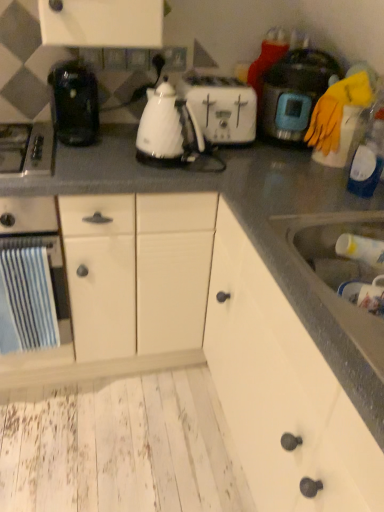
Question: Can you confirm if white glossy electric kettle at center, positioned as the second kitchen appliance in right-to-left order, is positioned to the left of blue striped towel at left, marked as the third kitchen appliance in a right-to-left arrangement?

Choices:
 (A) no
 (B) yes

Answer: (A)

Question: Can you confirm if white glossy electric kettle at center, which ranks as the second kitchen appliance in left-to-right order, is positioned to the right of blue striped towel at left, the 1th kitchen appliance positioned from the left?

Choices:
 (A) no
 (B) yes

Answer: (B)

Question: Does white glossy electric kettle at center, which ranks as the second kitchen appliance in left-to-right order, turn towards blue striped towel at left, the 1th kitchen appliance positioned from the left?

Choices:
 (A) yes
 (B) no

Answer: (B)

Question: From the image's perspective, is white glossy electric kettle at center, positioned as the second kitchen appliance in right-to-left order, beneath blue striped towel at left, marked as the third kitchen appliance in a right-to-left arrangement?

Choices:
 (A) no
 (B) yes

Answer: (A)

Question: Does white glossy electric kettle at center, which ranks as the second kitchen appliance in left-to-right order, come behind blue striped towel at left, marked as the third kitchen appliance in a right-to-left arrangement?

Choices:
 (A) no
 (B) yes

Answer: (B)

Question: Considering the positions of satin silver gas stove at left and white glossy electric kettle at center, which ranks as the second kitchen appliance in left-to-right order, in the image, is satin silver gas stove at left wider or thinner than white glossy electric kettle at center, which ranks as the second kitchen appliance in left-to-right order,?

Choices:
 (A) wide
 (B) thin

Answer: (A)

Question: From the image's perspective, is satin silver gas stove at left positioned above or below white glossy electric kettle at center, positioned as the second kitchen appliance in right-to-left order?

Choices:
 (A) above
 (B) below

Answer: (B)

Question: From a real-world perspective, is satin silver gas stove at left physically located above or below white glossy electric kettle at center, which ranks as the second kitchen appliance in left-to-right order?

Choices:
 (A) below
 (B) above

Answer: (A)

Question: In terms of height, does satin silver gas stove at left look taller or shorter compared to white glossy electric kettle at center, positioned as the second kitchen appliance in right-to-left order?

Choices:
 (A) short
 (B) tall

Answer: (A)

Question: Is white plastic bottle at sink, the 1th bottle when ordered from bottom to top, in front of or behind matte black rice cooker at upper right, the 3th kitchen appliance viewed from the left, in the image?

Choices:
 (A) behind
 (B) front

Answer: (B)

Question: Considering the positions of white plastic bottle at sink, the 1th bottle when ordered from bottom to top, and matte black rice cooker at upper right, which ranks as the first kitchen appliance in right-to-left order, in the image, is white plastic bottle at sink, the 1th bottle when ordered from bottom to top, bigger or smaller than matte black rice cooker at upper right, which ranks as the first kitchen appliance in right-to-left order,?

Choices:
 (A) big
 (B) small

Answer: (B)

Question: Is white plastic bottle at sink, the 1th bottle when ordered from bottom to top, taller or shorter than matte black rice cooker at upper right, the 3th kitchen appliance viewed from the left?

Choices:
 (A) short
 (B) tall

Answer: (A)

Question: In the image, is white plastic bottle at sink, the second bottle viewed from the top, on the left side or the right side of matte black rice cooker at upper right, which ranks as the first kitchen appliance in right-to-left order?

Choices:
 (A) left
 (B) right

Answer: (B)

Question: Relative to white matte cabinet at center, acting as the first cabinetry starting from the back, is white glossy electric kettle at center, positioned as the second kitchen appliance in right-to-left order, in front or behind?

Choices:
 (A) front
 (B) behind

Answer: (B)

Question: From a real-world perspective, is white glossy electric kettle at center, positioned as the second kitchen appliance in right-to-left order, above or below white matte cabinet at center, arranged as the second cabinetry when viewed from the front?

Choices:
 (A) below
 (B) above

Answer: (B)